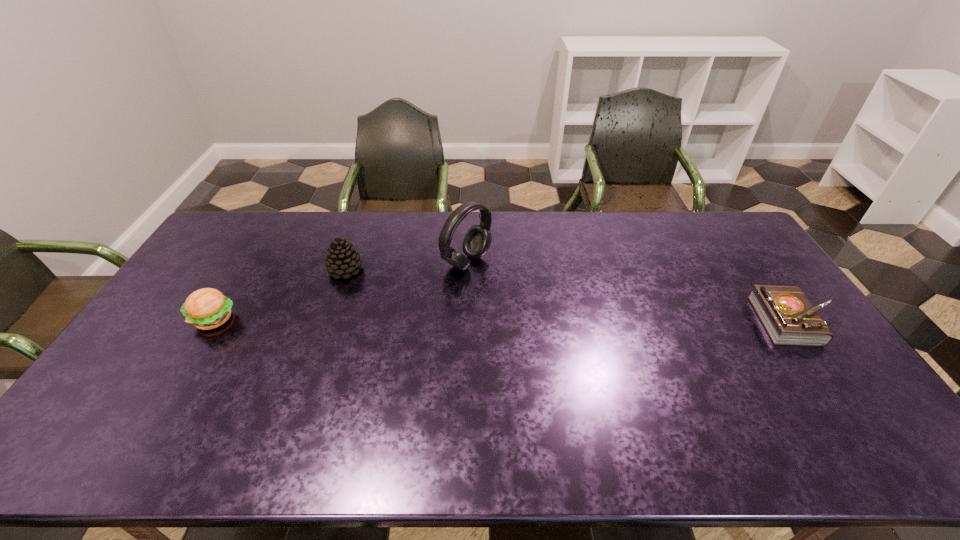
Find the location of `empty location between the leftmost object and the second object from right to left`. empty location between the leftmost object and the second object from right to left is located at coordinates (340, 291).

This screenshot has height=540, width=960. Identify the location of free space between the third object from right to left and the shortest object. (569, 295).

You are a GUI agent. You are given a task and a screenshot of the screen. Output one action in this format:
    pyautogui.click(x=<x>, y=<y>)
    Task: Click on the free spot between the tallest object and the pinecone
    
    Given the screenshot: What is the action you would take?
    pyautogui.click(x=406, y=266)

Find the location of a particular element. The height and width of the screenshot is (540, 960). vacant point located between the second object from right to left and the hamburger is located at coordinates (340, 291).

At what (x,y) coordinates should I click in order to perform the action: click on object that stands as the closest to the hamburger. Please return your answer as a coordinate pair (x, y). The width and height of the screenshot is (960, 540). Looking at the image, I should click on (342, 259).

In order to click on the second closest object to the diary in this screenshot , I will do `click(342, 259)`.

Where is `free space that satisfies the following two spatial constraints: 1. on the back side of the third tallest object; 2. on the left side of the third shortest object`? The height and width of the screenshot is (540, 960). free space that satisfies the following two spatial constraints: 1. on the back side of the third tallest object; 2. on the left side of the third shortest object is located at coordinates (244, 270).

Find the location of a particular element. The width and height of the screenshot is (960, 540). free space that satisfies the following two spatial constraints: 1. on the back side of the second object from left to right; 2. on the left side of the third object from left to right is located at coordinates (348, 262).

Where is `vacant area in the image that satisfies the following two spatial constraints: 1. on the back side of the tallest object; 2. on the right side of the hamburger`? vacant area in the image that satisfies the following two spatial constraints: 1. on the back side of the tallest object; 2. on the right side of the hamburger is located at coordinates (249, 262).

The image size is (960, 540). Identify the location of vacant space that satisfies the following two spatial constraints: 1. on the back side of the tallest object; 2. on the left side of the hamburger. (249, 262).